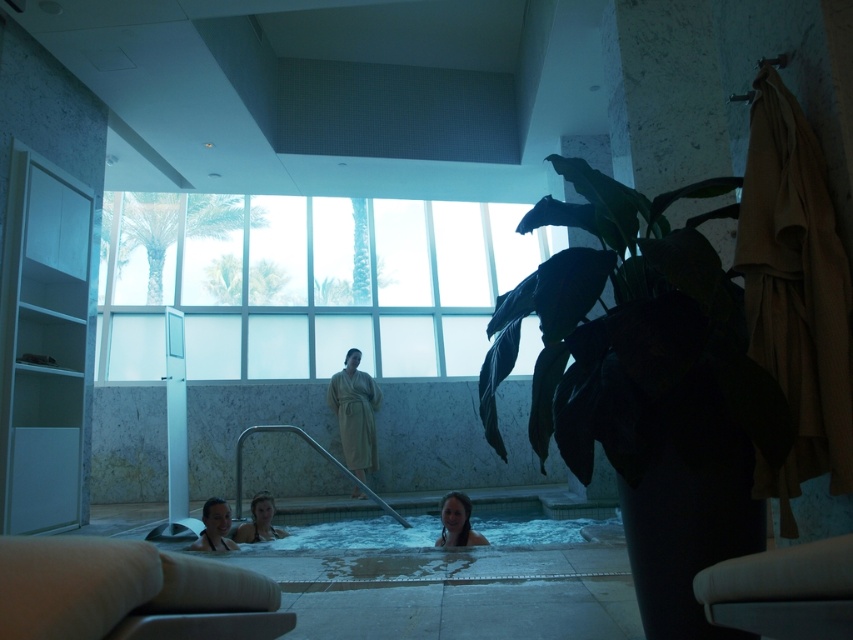
Question: Is smooth skin person at lower left positioned before smooth white swimsuit at lower center?

Choices:
 (A) no
 (B) yes

Answer: (B)

Question: Which of the following is the closest to the observer?

Choices:
 (A) (212, 524)
 (B) (341, 406)
 (C) (444, 504)

Answer: (A)

Question: Does beige robe at center lie in front of smooth skin person at lower center?

Choices:
 (A) yes
 (B) no

Answer: (B)

Question: Which point is farther to the camera?

Choices:
 (A) (367, 467)
 (B) (462, 509)
 (C) (231, 547)
 (D) (263, 492)

Answer: (A)

Question: Which point is farther to the camera?

Choices:
 (A) smooth skin person at lower left
 (B) beige robe at center
 (C) smooth skin person at lower center

Answer: (B)

Question: Does smooth skin person at lower center have a larger size compared to smooth skin person at lower left?

Choices:
 (A) yes
 (B) no

Answer: (B)